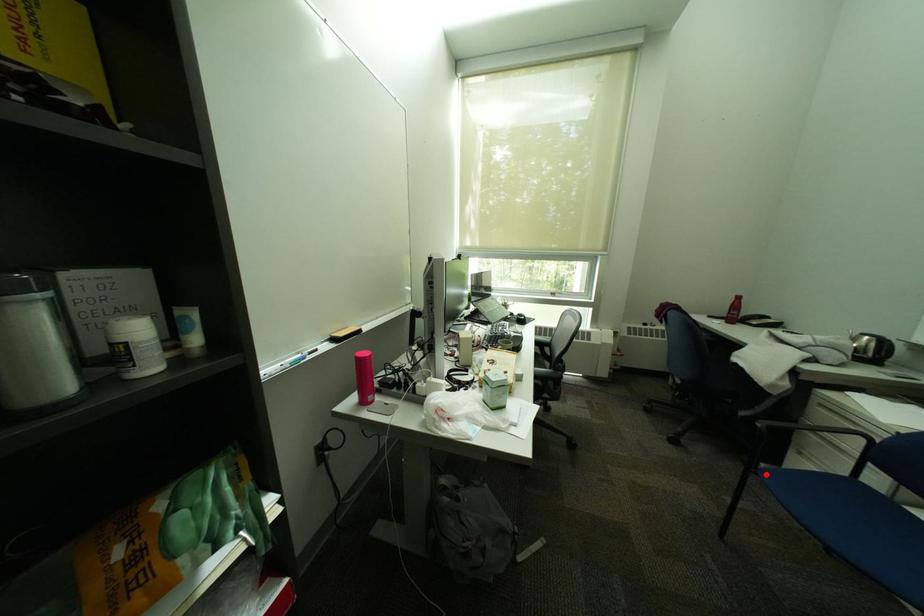
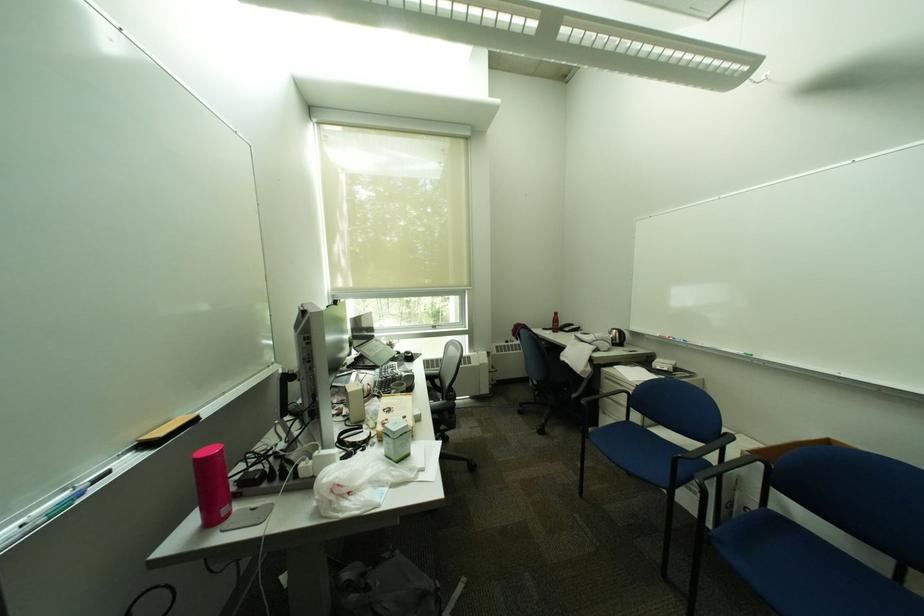
Question: I am providing you with two images of the same scene from different viewpoints. Image1 has a red point marked. In image2, the corresponding 3D location appears at what relative position? Reply with the corresponding letter.

Choices:
 (A) Closer
 (B) Farther

Answer: (A)